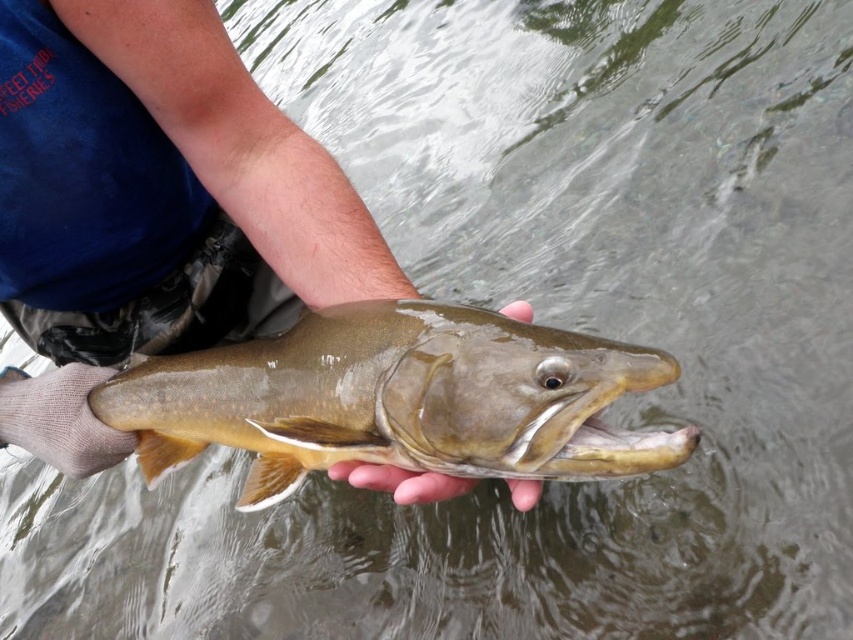
Question: Does shiny brown fish at center have a smaller size compared to smooth brown fish at center?

Choices:
 (A) yes
 (B) no

Answer: (B)

Question: Estimate the real-world distances between objects in this image. Which object is closer to the smooth skin hand at center?

Choices:
 (A) shiny brown fish at center
 (B) smooth brown fish at center

Answer: (B)

Question: Is shiny brown fish at center below smooth brown fish at center?

Choices:
 (A) yes
 (B) no

Answer: (A)

Question: Among these objects, which one is farthest from the camera?

Choices:
 (A) smooth skin hand at center
 (B) shiny brown fish at center
 (C) smooth brown fish at center

Answer: (C)

Question: Does shiny brown fish at center have a larger size compared to smooth skin hand at center?

Choices:
 (A) yes
 (B) no

Answer: (A)

Question: Estimate the real-world distances between objects in this image. Which object is closer to the smooth skin hand at center?

Choices:
 (A) shiny brown fish at center
 (B) smooth brown fish at center

Answer: (B)